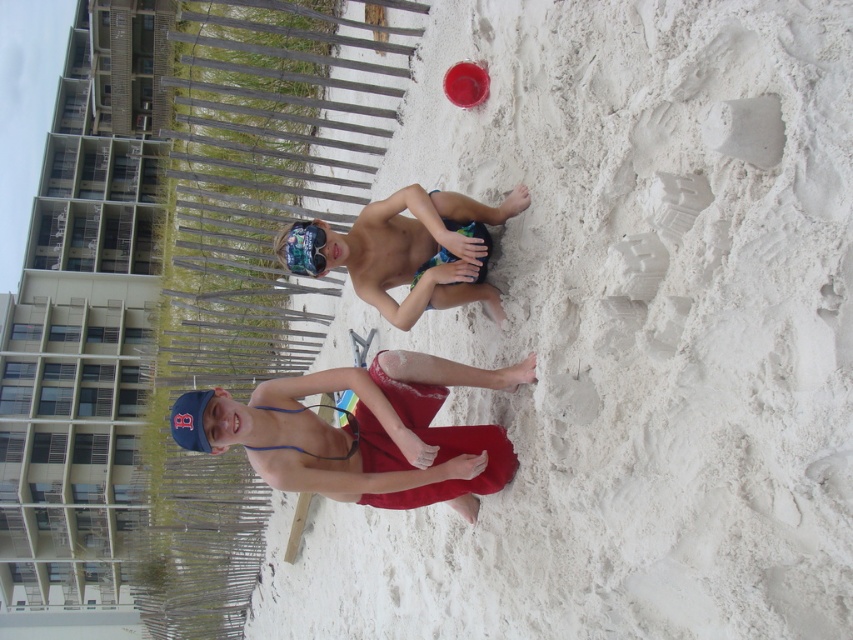
Question: Is red fabric shorts at center wider than printed fabric shorts at center?

Choices:
 (A) no
 (B) yes

Answer: (A)

Question: Does white sandy beach at center appear under printed fabric shorts at center?

Choices:
 (A) yes
 (B) no

Answer: (A)

Question: Which of the following is the farthest from the observer?

Choices:
 (A) (514, 588)
 (B) (515, 374)

Answer: (A)

Question: Which object is the closest to the blue rubber goggles at center?

Choices:
 (A) printed fabric shorts at center
 (B) white sandy beach at center

Answer: (A)

Question: Which point is farther to the camera?

Choices:
 (A) (314, 221)
 (B) (323, 476)
 (C) (463, 256)

Answer: (A)

Question: Does white sandy beach at center appear over red fabric shorts at center?

Choices:
 (A) yes
 (B) no

Answer: (A)